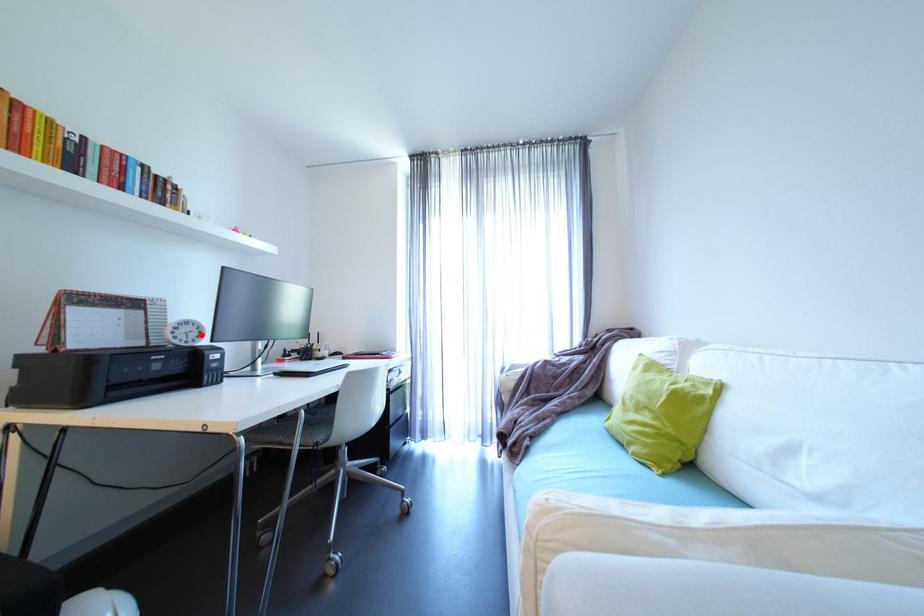
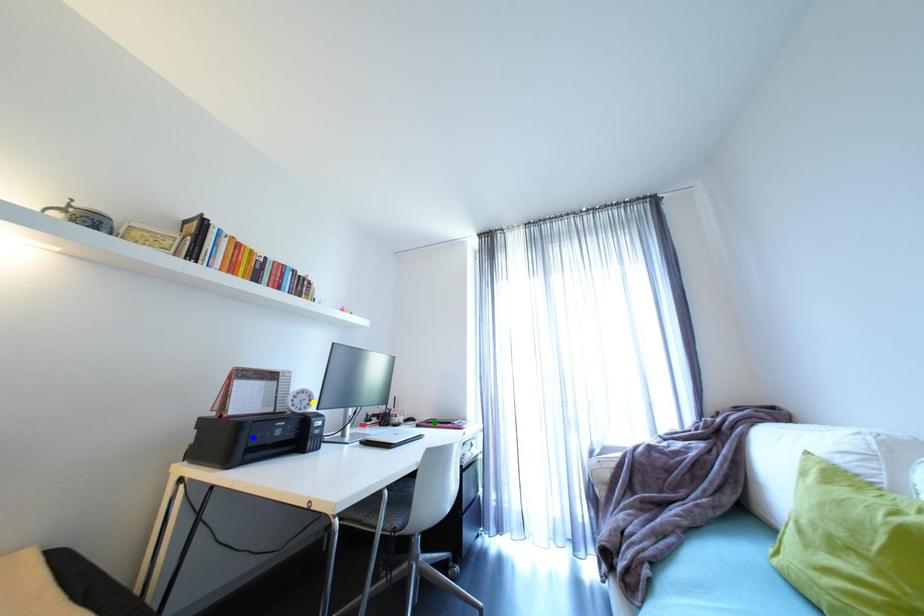
Question: I am providing you with two images of the same scene from different viewpoints. A red point is marked on the first image. You are given multiple points on the second image. Which point in image 2 is actually the same real-world point as the red point in image 1?

Choices:
 (A) yellow point
 (B) blue point
 (C) green point

Answer: (A)